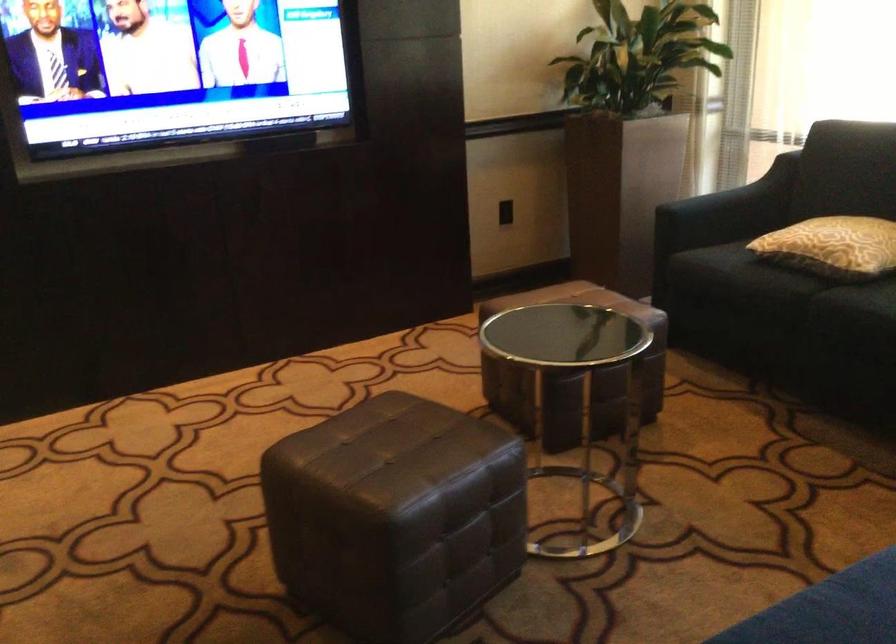
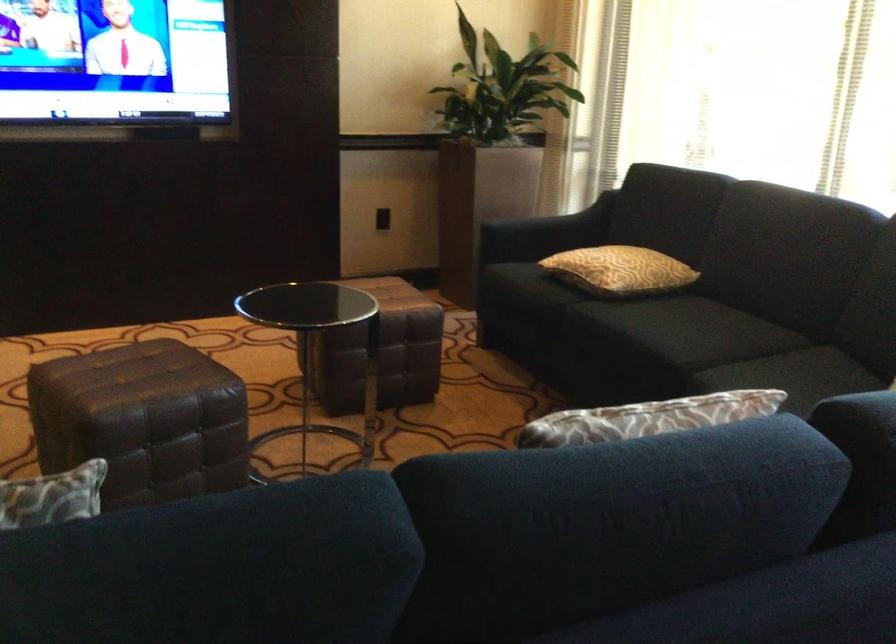
The images are taken continuously from a first-person perspective. In which direction are you moving?

The movement direction of the cameraman is right, backward.